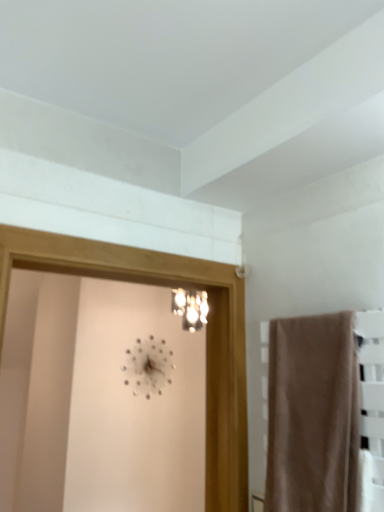
Question: Considering the relative positions of metallic silver clock at upper center and beige fabric towel at right in the image provided, is metallic silver clock at upper center to the left or to the right of beige fabric towel at right?

Choices:
 (A) left
 (B) right

Answer: (A)

Question: Considering the positions of point (135, 361) and point (357, 371), is point (135, 361) closer or farther from the camera than point (357, 371)?

Choices:
 (A) closer
 (B) farther

Answer: (B)

Question: Which is farther from the clear glass screen door at center?

Choices:
 (A) beige fabric towel at right
 (B) metallic silver clock at upper center

Answer: (B)

Question: Which object is the farthest from the metallic silver clock at upper center?

Choices:
 (A) clear glass screen door at center
 (B) beige fabric towel at right

Answer: (B)